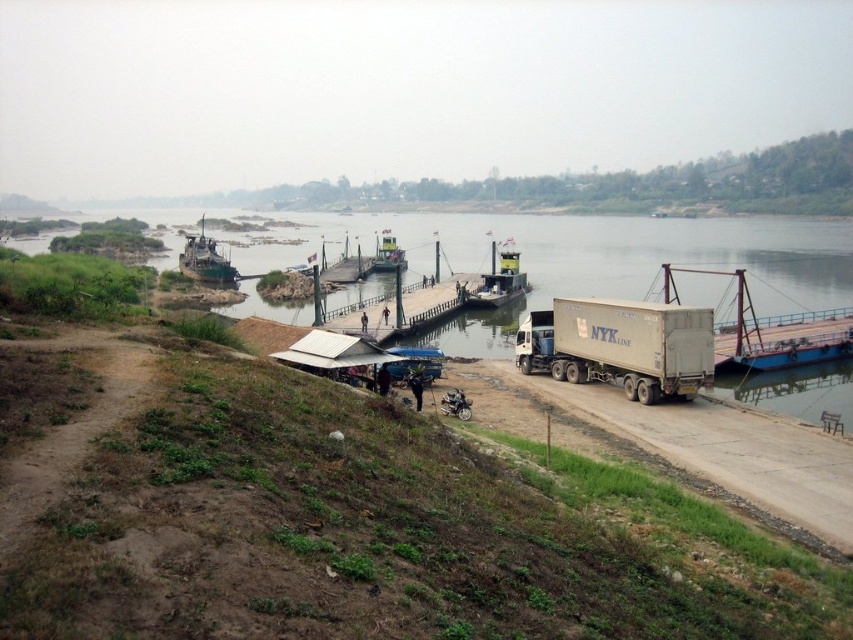
Is white matte trailer truck at center taller than green plastic boat at center?

No, white matte trailer truck at center is not taller than green plastic boat at center.

Is white matte trailer truck at center closer to the viewer compared to green plastic boat at center?

Yes, it is in front of green plastic boat at center.

At what (x,y) coordinates should I click in order to perform the action: click on white matte trailer truck at center. Please return your answer as a coordinate pair (x, y). Looking at the image, I should click on (619, 346).

This screenshot has width=853, height=640. I want to click on white matte trailer truck at center, so click(619, 346).

From the picture: Does white matte trailer truck at center have a lesser height compared to dark gray metallic barge at center?

Indeed, white matte trailer truck at center has a lesser height compared to dark gray metallic barge at center.

Locate an element on the screen. Image resolution: width=853 pixels, height=640 pixels. white matte trailer truck at center is located at coordinates (619, 346).

What do you see at coordinates (619, 346) in the screenshot? This screenshot has width=853, height=640. I see `white matte trailer truck at center` at bounding box center [619, 346].

Find the location of a particular element. white matte trailer truck at center is located at coordinates (619, 346).

Is brown dirt track at lower left in front of green plastic boat at center?

Yes, it is.

This screenshot has width=853, height=640. What do you see at coordinates (73, 424) in the screenshot? I see `brown dirt track at lower left` at bounding box center [73, 424].

This screenshot has height=640, width=853. In order to click on brown dirt track at lower left in this screenshot , I will do `click(73, 424)`.